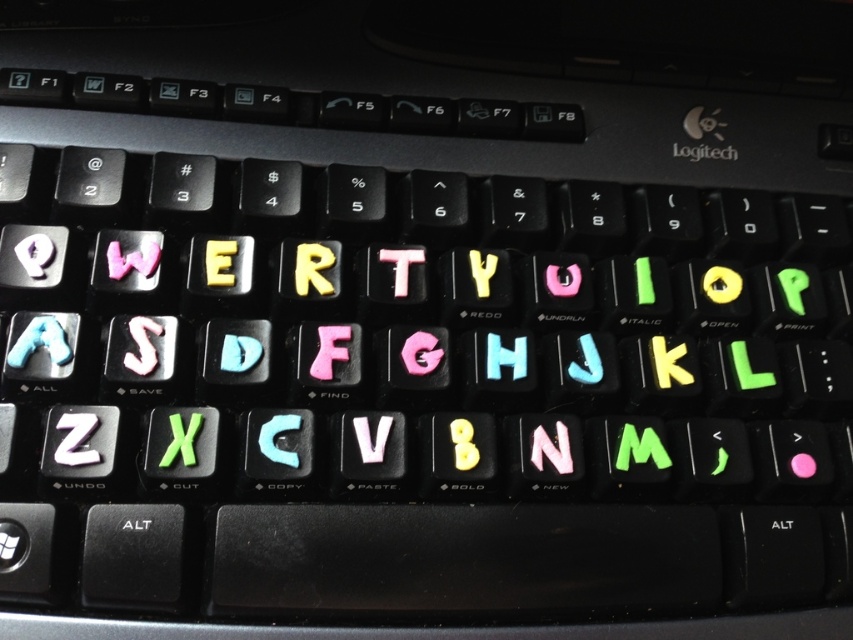
Question: Among these objects, which one is nearest to the camera?

Choices:
 (A) yellow matte letter e at center
 (B) green matte letter m at center
 (C) glowing plastic j at center
 (D) white glossy letter s at center-left

Answer: (D)

Question: Is blue glossy letter h at center wider than white glossy letter s at center-left?

Choices:
 (A) no
 (B) yes

Answer: (B)

Question: Is pink glossy letter n at center thinner than pink matte letter g at center?

Choices:
 (A) no
 (B) yes

Answer: (A)

Question: Among these objects, which one is farthest from the camera?

Choices:
 (A) pink rubber letter f at center
 (B) yellow matte letter k at center
 (C) pink matte letter g at center
 (D) green matte letter p at center-right

Answer: (D)

Question: Among these objects, which one is farthest from the camera?

Choices:
 (A) white glossy letter s at center-left
 (B) translucent plastic letter c at center

Answer: (A)

Question: Is pink rubber letter f at center below yellow matte letter k at center?

Choices:
 (A) yes
 (B) no

Answer: (B)